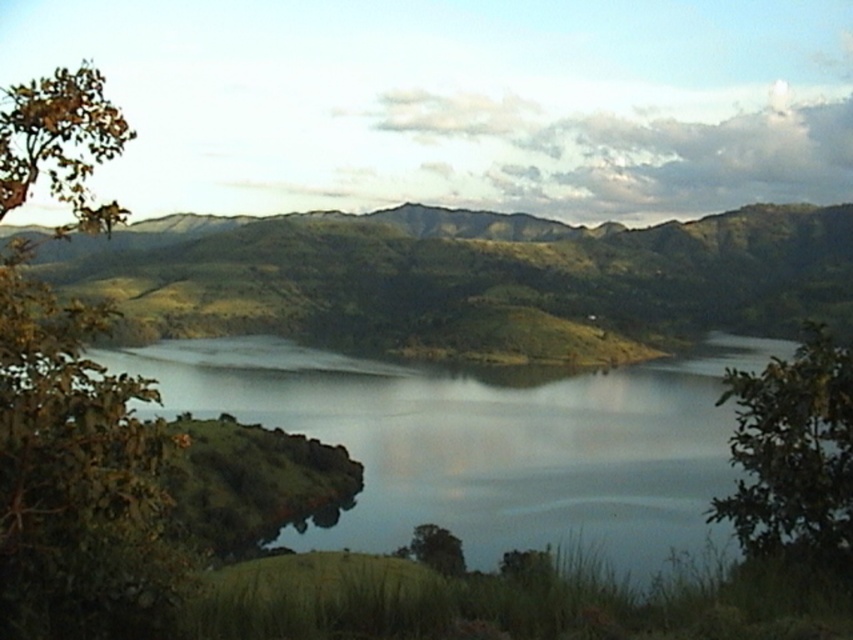
You are standing at the edge of the lake and see the transparent water at center and the green leafy tree at lower right. Which object is closer to your left side?

The transparent water at center is to the left of green leafy tree at lower right, so the transparent water at center is closer to your left side.